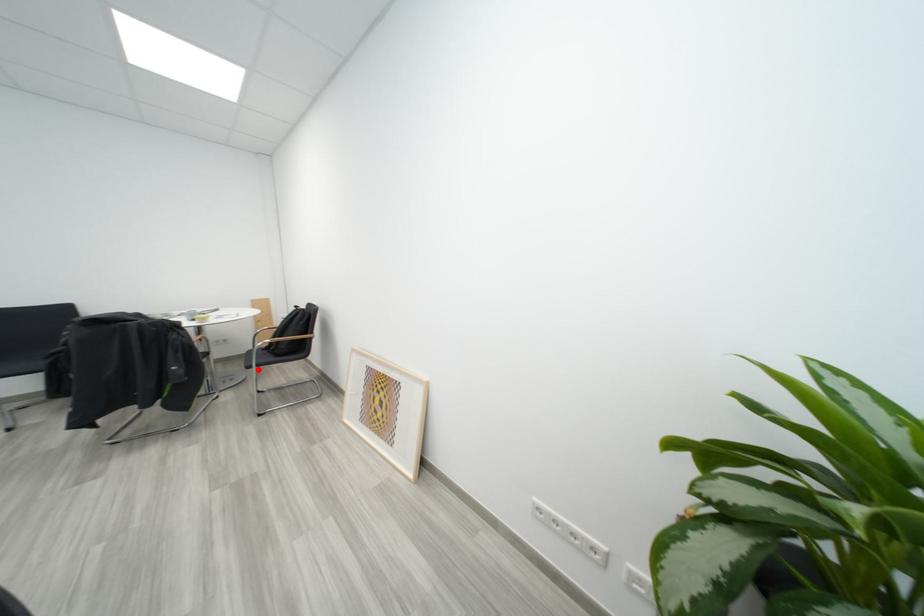
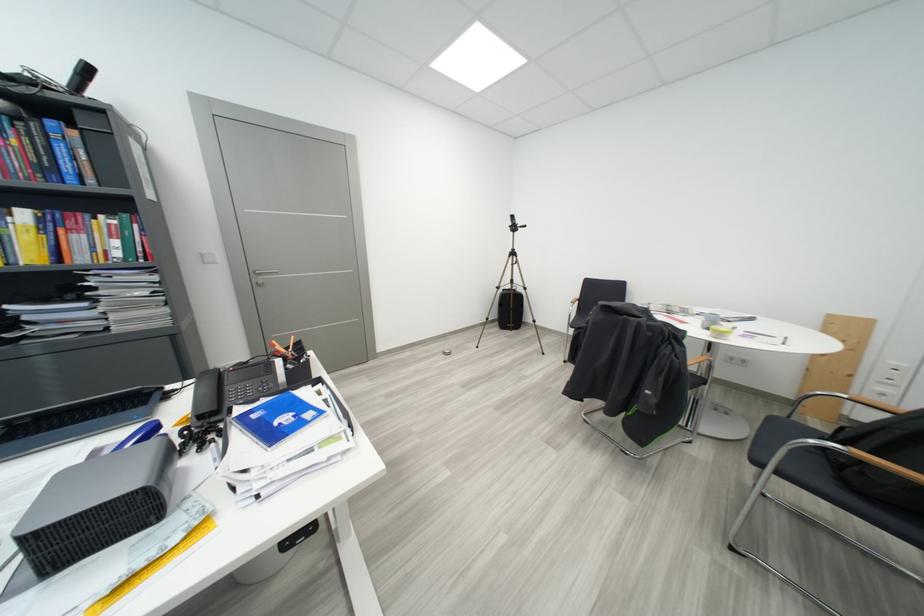
In the second image, find the point that corresponds to the highlighted location in the first image.

(767, 466)